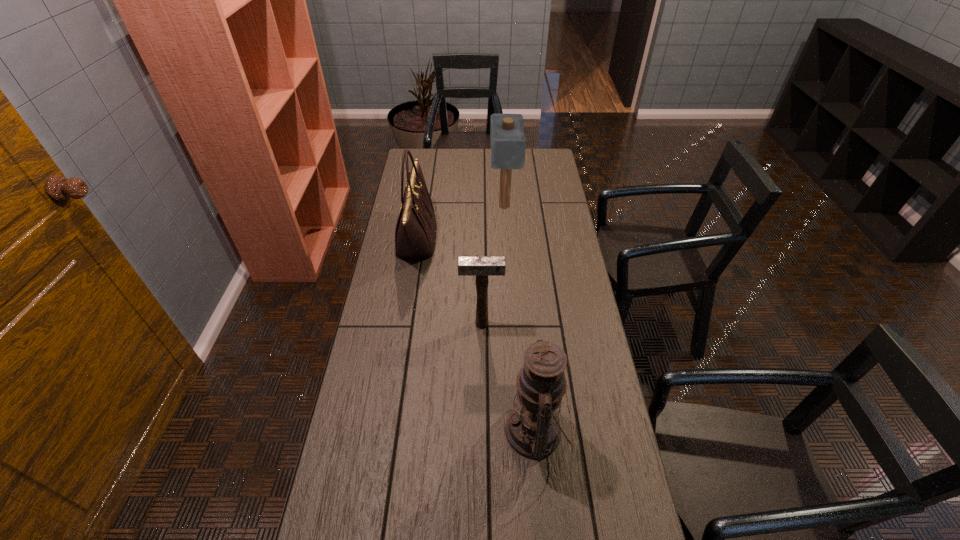
You are a GUI agent. You are given a task and a screenshot of the screen. Output one action in this format:
    pyautogui.click(x=<x>, y=<y>)
    Task: Click on the object positioned at the right edge
    This screenshot has height=540, width=960.
    Given the screenshot: What is the action you would take?
    pyautogui.click(x=532, y=429)

Identify the location of blank space at the left edge. The width and height of the screenshot is (960, 540). (364, 500).

You are a GUI agent. You are given a task and a screenshot of the screen. Output one action in this format:
    pyautogui.click(x=<x>, y=<y>)
    Task: Click on the blank space at the right edge of the desktop
    The height and width of the screenshot is (540, 960).
    Given the screenshot: What is the action you would take?
    pyautogui.click(x=588, y=296)

In the image, there is a desktop. In order to click on free space at the far right corner in this screenshot , I will do `click(531, 150)`.

At what (x,y) coordinates should I click in order to perform the action: click on free spot between the oil lamp and the shorter mallet. Please return your answer as a coordinate pair (x, y). Looking at the image, I should click on (509, 377).

Identify the location of vacant space that is in between the shorter mallet and the nearest object. (509, 377).

What are the coordinates of `free space between the handbag and the oil lamp` in the screenshot? It's located at (476, 335).

Find the location of a particular element. This screenshot has height=540, width=960. free point between the shorter mallet and the nearest object is located at coordinates (509, 377).

The height and width of the screenshot is (540, 960). What are the coordinates of `unoccupied position between the nearest object and the leftmost object` in the screenshot? It's located at 476,335.

I want to click on free space between the oil lamp and the leftmost object, so click(x=476, y=335).